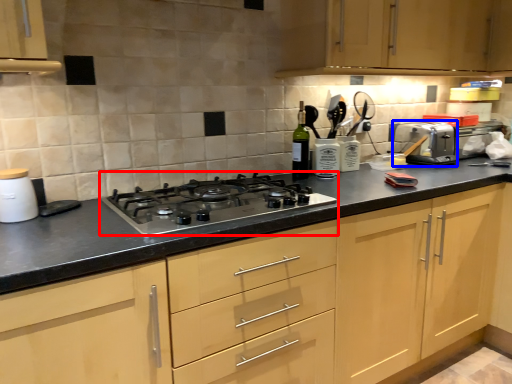
Question: Which point is further to the camera, gas stove (highlighted by a red box) or toaster (highlighted by a blue box)?

Choices:
 (A) gas stove
 (B) toaster

Answer: (B)